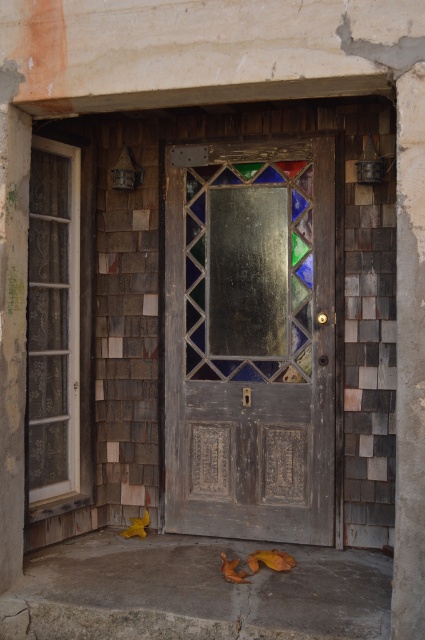
What do you see at coordinates (249, 269) in the screenshot? I see `stained glass panel at center` at bounding box center [249, 269].

Does stained glass panel at center have a lesser height compared to clear glass window at left?

Indeed, stained glass panel at center has a lesser height compared to clear glass window at left.

The width and height of the screenshot is (425, 640). Identify the location of stained glass panel at center. (249, 269).

Image resolution: width=425 pixels, height=640 pixels. I want to click on stained glass panel at center, so 249,269.

From the picture: Can you confirm if stained glass door at center is thinner than clear glass window at left?

No, stained glass door at center is not thinner than clear glass window at left.

Is point (198, 388) in front of point (51, 340)?

No, (198, 388) is behind (51, 340).

This screenshot has height=640, width=425. What are the coordinates of `stained glass door at center` in the screenshot? It's located at (249, 339).

Can you confirm if stained glass door at center is positioned to the left of stained glass panel at center?

Indeed, stained glass door at center is positioned on the left side of stained glass panel at center.

Looking at this image, who is positioned more to the right, stained glass door at center or stained glass panel at center?

Positioned to the right is stained glass panel at center.

Measure the distance between stained glass door at center and camera.

The distance of stained glass door at center from camera is 5.43 meters.

Locate an element on the screen. The width and height of the screenshot is (425, 640). stained glass door at center is located at coordinates (249, 339).